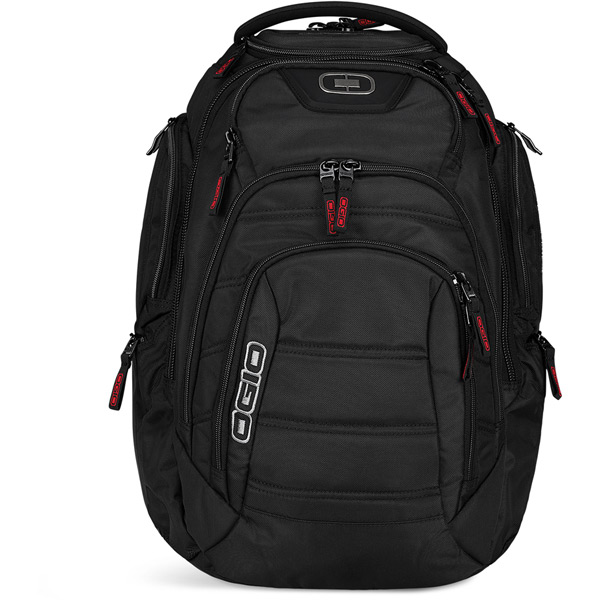
The height and width of the screenshot is (600, 600). What are the coordinates of `handle` in the screenshot? It's located at (385, 8).